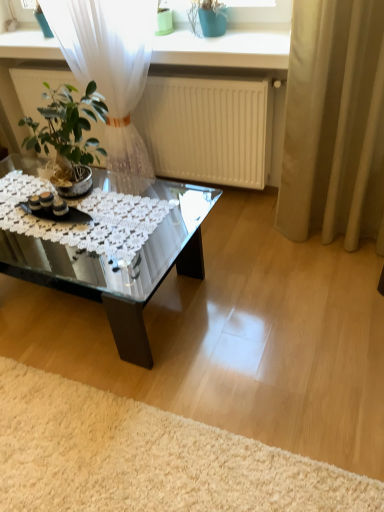
This screenshot has width=384, height=512. I want to click on free point in front of beige fabric curtain at right, so click(x=330, y=276).